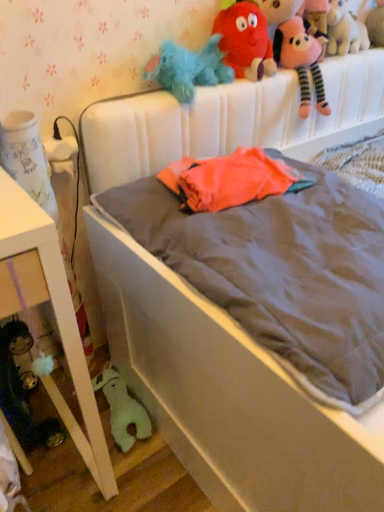
Question: Considering the positions of green plush toy at lower left, marked as the 5th toy in a right-to-left arrangement, and pink plush unicorn at upper right, which appears as the second toy when viewed from the right, in the image, is green plush toy at lower left, marked as the 5th toy in a right-to-left arrangement, taller or shorter than pink plush unicorn at upper right, which appears as the second toy when viewed from the right,?

Choices:
 (A) tall
 (B) short

Answer: (B)

Question: From a real-world perspective, is green plush toy at lower left, the fifth toy from the top, above or below pink plush unicorn at upper right, marked as the 4th toy in a bottom-to-top arrangement?

Choices:
 (A) above
 (B) below

Answer: (B)

Question: Estimate the real-world distances between objects in this image. Which object is closer to the white fabric bed at center?

Choices:
 (A) fuzzy beige stuffed animal at upper right, which is the 1th toy from right to left
 (B) fluffy plush toys at upper right
 (C) white glossy nightstand at lower left
 (D) pink plush unicorn at upper right, which appears as the second toy when viewed from the right
 (E) green plush toy at lower left, marked as the 5th toy in a right-to-left arrangement

Answer: (B)

Question: Which is farther from the fuzzy beige stuffed animal at upper right, arranged as the 1th toy when viewed from the top?

Choices:
 (A) green plush toy at lower left, the fifth toy from the top
 (B) fluffy plush toys at upper right
 (C) pink plush unicorn at upper right, which appears as the second toy when viewed from the right
 (D) white fabric bed at center
 (E) fuzzy blue stuffed animal at upper center, which is counted as the fourth toy, starting from the top

Answer: (A)